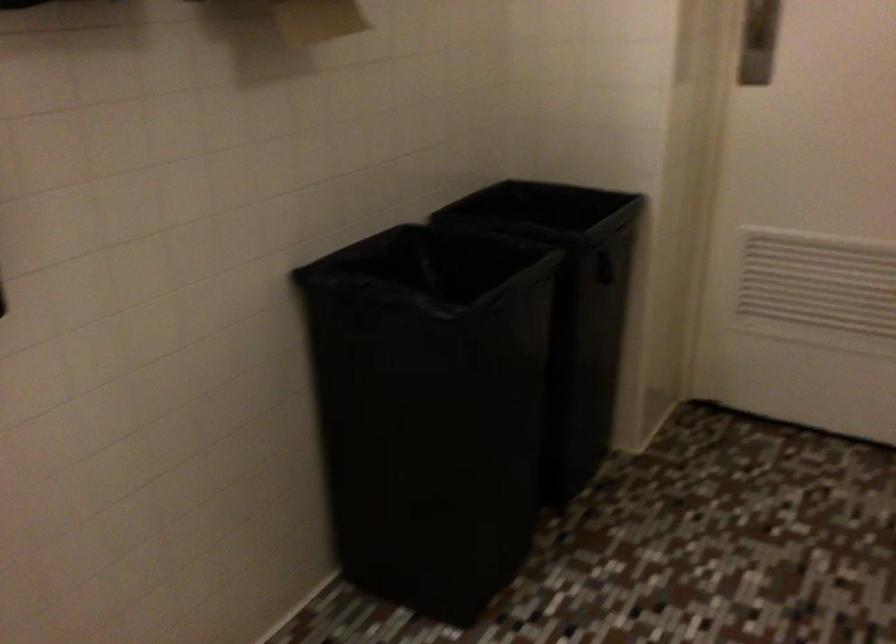
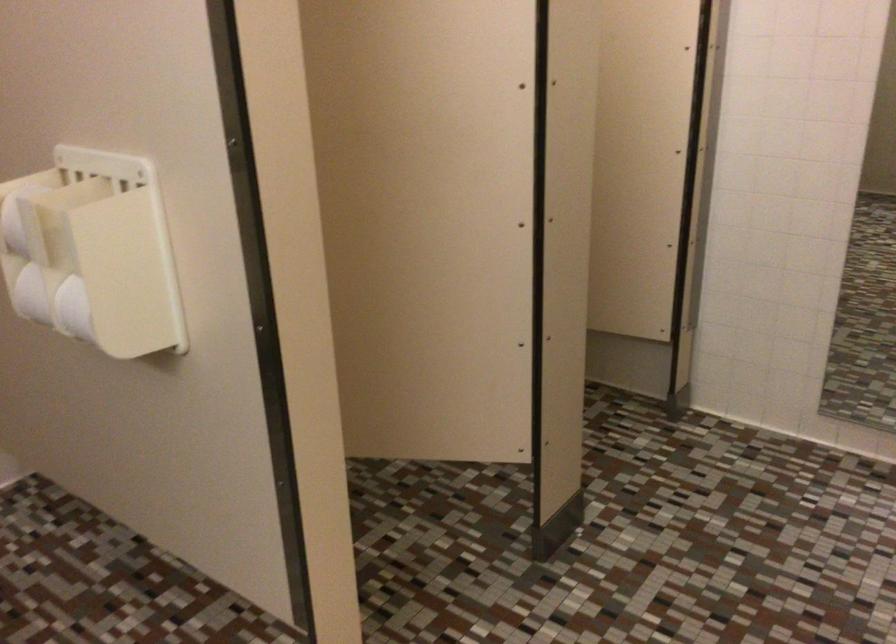
Consider the image. The first image is from the beginning of the video and the second image is from the end. How did the camera likely rotate when shooting the video?

The rotation direction of the camera is right-down.